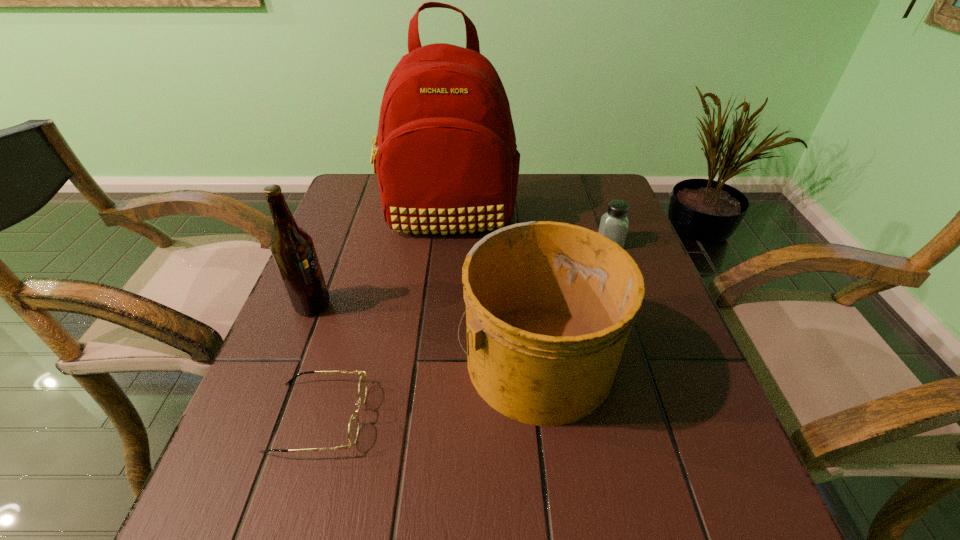
The height and width of the screenshot is (540, 960). Identify the location of vacant space that satisfies the following two spatial constraints: 1. on the front side of the rightmost object; 2. on the label of the second tallest object. (632, 305).

Locate an element on the screen. free location that satisfies the following two spatial constraints: 1. on the front-facing side of the tallest object; 2. on the lenses of the shortest object is located at coordinates point(429,417).

Locate an element on the screen. This screenshot has height=540, width=960. free region that satisfies the following two spatial constraints: 1. on the front side of the third shortest object; 2. on the lenses of the shortest object is located at coordinates (543, 417).